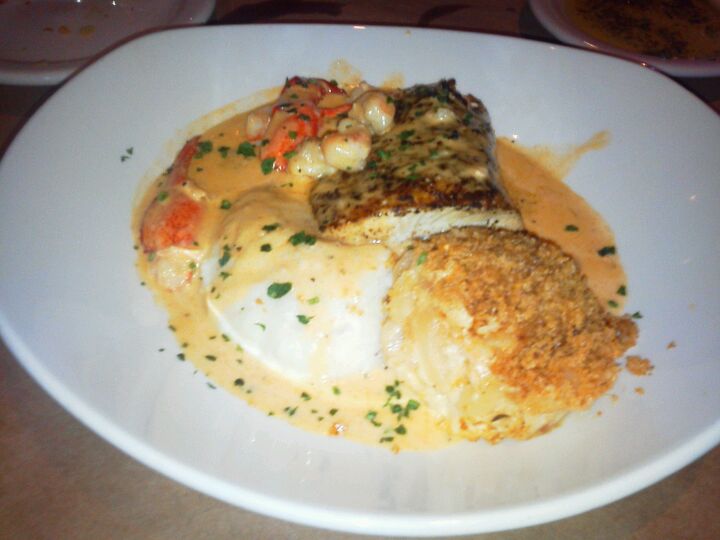
The width and height of the screenshot is (720, 540). What are the coordinates of `dishes in background` in the screenshot? It's located at (88, 33), (603, 19).